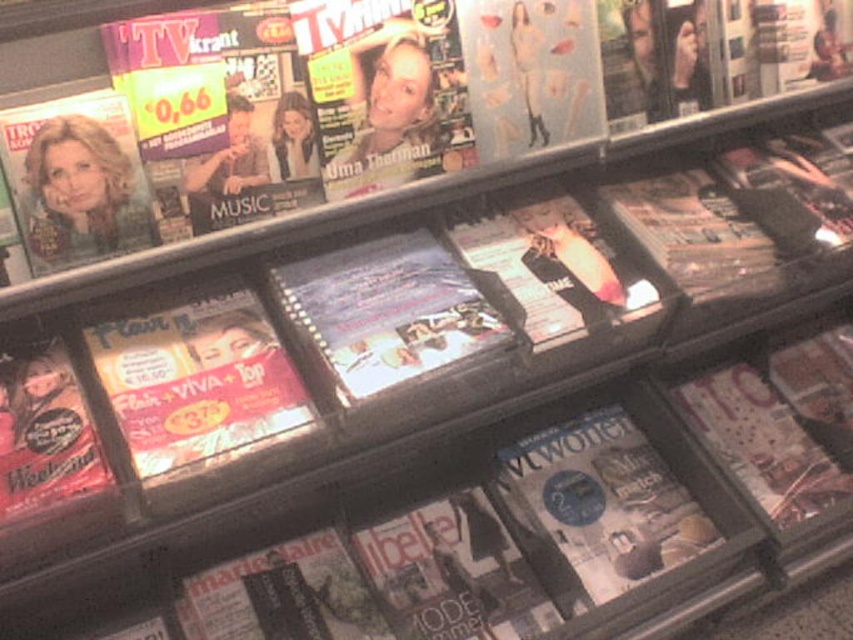
You are a customer looking to buy a magazine. You notice two magazines at the center of the top shelf in the magazine rack. One is a blue glossy magazine at center and the other is a matte glossy magazine at center. Which one is taller?

The blue glossy magazine at center is much taller than the matte glossy magazine at center.

You are a customer looking at the top shelf of the magazine rack. You see the matte plastic magazine at center left and the matte glossy magazine at center. Which one is more to the left?

The matte plastic magazine at center left is more to the left.